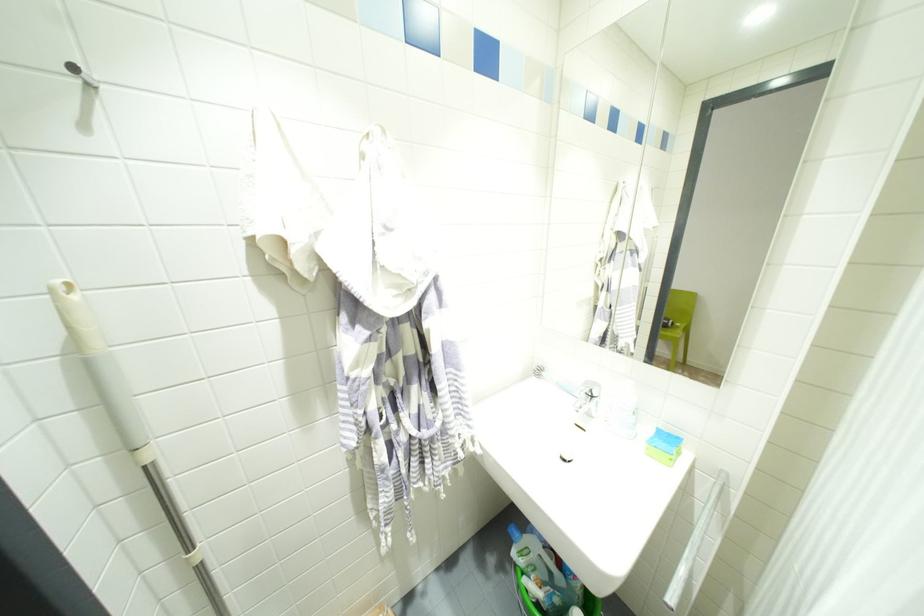
Image resolution: width=924 pixels, height=616 pixels. What do you see at coordinates (128, 421) in the screenshot? I see `the white mop handle` at bounding box center [128, 421].